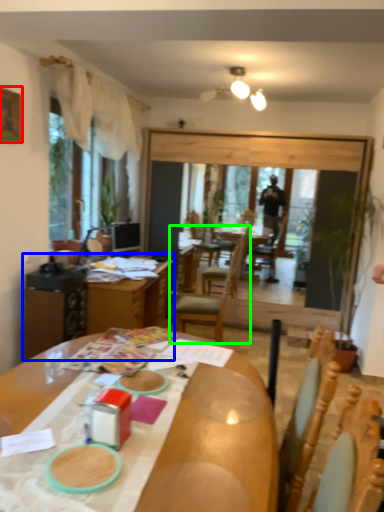
Question: Which is nearer to the picture frame (highlighted by a red box)? table (highlighted by a blue box) or chair (highlighted by a green box).

Choices:
 (A) table
 (B) chair

Answer: (A)